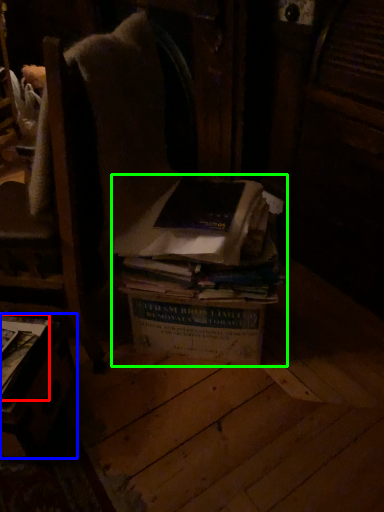
Question: Which object is positioned closest to book (highlighted by a red box)? Select from table (highlighted by a blue box) and book (highlighted by a green box).

Choices:
 (A) table
 (B) book

Answer: (A)